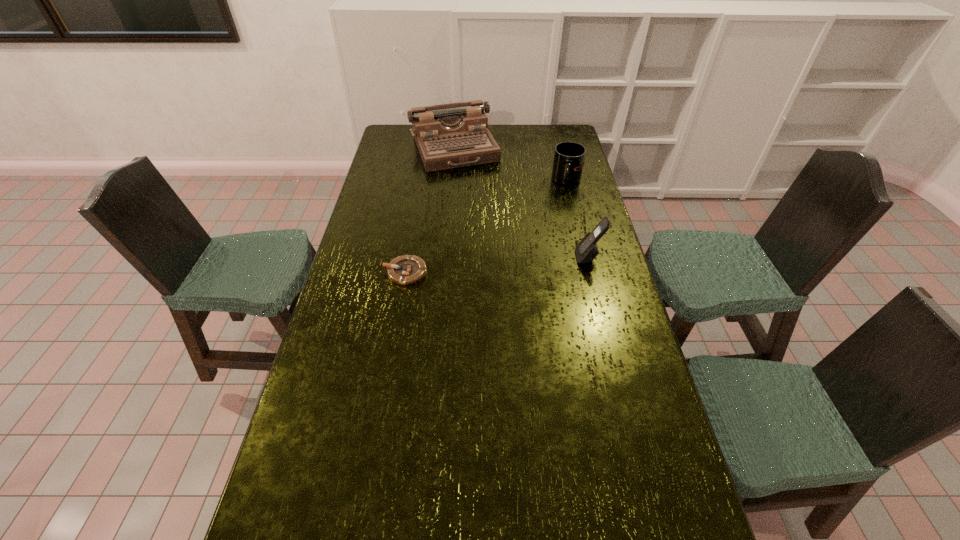
Identify the location of unoccupied position between the cellular telephone and the shortest object. Image resolution: width=960 pixels, height=540 pixels. (497, 265).

I want to click on free space between the typewriter and the mug, so click(511, 165).

This screenshot has width=960, height=540. I want to click on unoccupied position between the mug and the typewriter, so coord(511,165).

At what (x,y) coordinates should I click in order to perform the action: click on vacant region between the cellular telephone and the ashtray. Please return your answer as a coordinate pair (x, y). Looking at the image, I should click on (497, 265).

You are a GUI agent. You are given a task and a screenshot of the screen. Output one action in this format:
    pyautogui.click(x=<x>, y=<y>)
    Task: Click on the free space between the second tallest object and the typewriter
    
    Given the screenshot: What is the action you would take?
    pyautogui.click(x=521, y=203)

You are a GUI agent. You are given a task and a screenshot of the screen. Output one action in this format:
    pyautogui.click(x=<x>, y=<y>)
    Task: Click on the object that is the closest one to the typewriter
    
    Given the screenshot: What is the action you would take?
    pos(568,162)

Locate which object is the closest to the third shortest object. Please provide its 2D coordinates. Your answer should be formatted as a tuple, i.e. [(x, y)], where the tuple contains the x and y coordinates of a point satisfying the conditions above.

[(568, 162)]

At what (x,y) coordinates should I click in order to perform the action: click on free space that satisfies the following two spatial constraints: 1. on the front side of the typewriter; 2. on the right side of the mug. Please return your answer as a coordinate pair (x, y). Looking at the image, I should click on (451, 181).

Where is `free space in the image that satisfies the following two spatial constraints: 1. on the front side of the typewriter; 2. on the front-facing side of the cellular telephone`? free space in the image that satisfies the following two spatial constraints: 1. on the front side of the typewriter; 2. on the front-facing side of the cellular telephone is located at coordinates (445, 257).

Locate an element on the screen. This screenshot has width=960, height=540. free spot that satisfies the following two spatial constraints: 1. on the back side of the shortest object; 2. on the left side of the second shortest object is located at coordinates (421, 181).